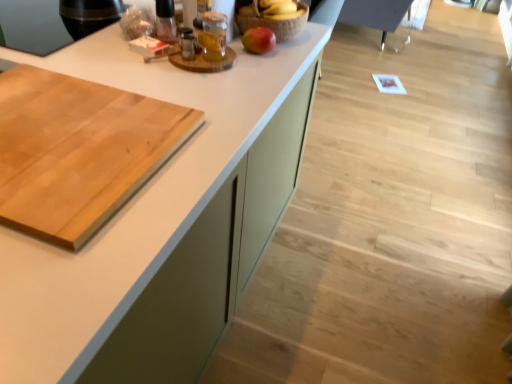
Measure the distance between point (x=258, y=27) and camera.

Point (x=258, y=27) and camera are 1.36 meters apart from each other.

Find the location of `red matte apple at upper center`. red matte apple at upper center is located at coordinates (259, 40).

Does translucent glass jar at upper center have a greater height compared to natural wood cutting board at left?

Correct, translucent glass jar at upper center is much taller as natural wood cutting board at left.

Consider the image. Does translucent glass jar at upper center turn towards natural wood cutting board at left?

Yes, translucent glass jar at upper center faces towards natural wood cutting board at left.

Would you consider translucent glass jar at upper center to be distant from natural wood cutting board at left?

That's not correct — translucent glass jar at upper center is a little close to natural wood cutting board at left.

Is point (69, 378) closer or farther from the camera than point (269, 40)?

Point (69, 378) is closer to the camera than point (269, 40).

Consider the image. Is red matte apple at upper center located within white matte countertop at center?

No, red matte apple at upper center is located outside of white matte countertop at center.

From the image's perspective, would you say white matte countertop at center is positioned over red matte apple at upper center?

No.

In terms of size, does white matte countertop at center appear bigger or smaller than translucent glass jar at upper center?

white matte countertop at center is bigger than translucent glass jar at upper center.

From a real-world perspective, is white matte countertop at center physically located above or below translucent glass jar at upper center?

Clearly, from a real-world perspective, white matte countertop at center is below translucent glass jar at upper center.

Based on the photo, is white matte countertop at center looking in the opposite direction of translucent glass jar at upper center?

That's not correct — white matte countertop at center is not looking away from translucent glass jar at upper center.

From the picture: Are red matte apple at upper center and translucent glass jar at upper center located far from each other?

No, there isn't a large distance between red matte apple at upper center and translucent glass jar at upper center.

Is red matte apple at upper center positioned with its back to translucent glass jar at upper center?

No, red matte apple at upper center's orientation is not away from translucent glass jar at upper center.

Where is `apple on the right of the translucent glass jar at upper center`? The image size is (512, 384). apple on the right of the translucent glass jar at upper center is located at coordinates click(x=259, y=40).

Who is smaller, red matte apple at upper center or translucent glass jar at upper center?

With smaller size is red matte apple at upper center.

Consider the image. Is red matte apple at upper center completely or partially inside translucent glass jar at upper center?

No, red matte apple at upper center is not a part of translucent glass jar at upper center.

Could you tell me if translucent glass jar at upper center is facing red matte apple at upper center?

No, translucent glass jar at upper center is not oriented towards red matte apple at upper center.

How far apart are translucent glass jar at upper center and red matte apple at upper center?

A distance of 5.97 inches exists between translucent glass jar at upper center and red matte apple at upper center.

In terms of size, does translucent glass jar at upper center appear bigger or smaller than red matte apple at upper center?

In the image, translucent glass jar at upper center appears to be larger than red matte apple at upper center.

What are the coordinates of `countertop that is on the right side of natural wood cutting board at left` in the screenshot? It's located at (133, 198).

In the scene shown: What's the angular difference between white matte countertop at center and natural wood cutting board at left's facing directions?

white matte countertop at center and natural wood cutting board at left are facing 90.9 degrees away from each other.

Does point (170, 184) lie in front of point (119, 152)?

Yes, it is.

Which object is closer to the camera, white matte countertop at center or natural wood cutting board at left?

white matte countertop at center.

Is natural wood cutting board at left not inside red matte apple at upper center?

natural wood cutting board at left is positioned outside red matte apple at upper center.

How many degrees apart are the facing directions of natural wood cutting board at left and red matte apple at upper center?

natural wood cutting board at left and red matte apple at upper center are facing 0.691 degrees away from each other.

Is point (50, 84) farther from camera compared to point (251, 32)?

No, it is not.

How much distance is there between natural wood cutting board at left and red matte apple at upper center?

natural wood cutting board at left is 26.40 inches from red matte apple at upper center.

The height and width of the screenshot is (384, 512). I want to click on beverage behind the natural wood cutting board at left, so coord(213,35).

Find the location of a particular element. The height and width of the screenshot is (384, 512). countertop lying in front of the red matte apple at upper center is located at coordinates (133, 198).

Estimate the real-world distances between objects in this image. Which object is closer to natural wood cutting board at left, white matte countertop at center or translucent glass jar at upper center?

white matte countertop at center is positioned closer to the anchor natural wood cutting board at left.

Looking at this image, based on their spatial positions, is translucent glass jar at upper center or natural wood cutting board at left further from red matte apple at upper center?

natural wood cutting board at left is further to red matte apple at upper center.

Which object lies further to the anchor point natural wood cutting board at left, white matte countertop at center or red matte apple at upper center?

Among the two, red matte apple at upper center is located further to natural wood cutting board at left.

Considering their positions, is white matte countertop at center positioned further to translucent glass jar at upper center than red matte apple at upper center?

white matte countertop at center lies further to translucent glass jar at upper center than the other object.

From the image, which object appears to be nearer to natural wood cutting board at left, translucent glass jar at upper center or red matte apple at upper center?

translucent glass jar at upper center.

Based on their spatial positions, is natural wood cutting board at left or white matte countertop at center further from translucent glass jar at upper center?

natural wood cutting board at left lies further to translucent glass jar at upper center than the other object.

Based on their spatial positions, is red matte apple at upper center or white matte countertop at center closer to translucent glass jar at upper center?

Among the two, red matte apple at upper center is located nearer to translucent glass jar at upper center.

Based on their spatial positions, is red matte apple at upper center or white matte countertop at center further from natural wood cutting board at left?

red matte apple at upper center.

The image size is (512, 384). I want to click on cutting board between white matte countertop at center and translucent glass jar at upper center along the z-axis, so click(78, 151).

Identify the location of cutting board positioned between white matte countertop at center and red matte apple at upper center from near to far. (78, 151).

At what (x,y) coordinates should I click in order to perform the action: click on beverage positioned between white matte countertop at center and red matte apple at upper center from near to far. Please return your answer as a coordinate pair (x, y). The height and width of the screenshot is (384, 512). Looking at the image, I should click on (213, 35).

At what (x,y) coordinates should I click in order to perform the action: click on beverage located between natural wood cutting board at left and red matte apple at upper center in the depth direction. Please return your answer as a coordinate pair (x, y). The image size is (512, 384). Looking at the image, I should click on (213, 35).